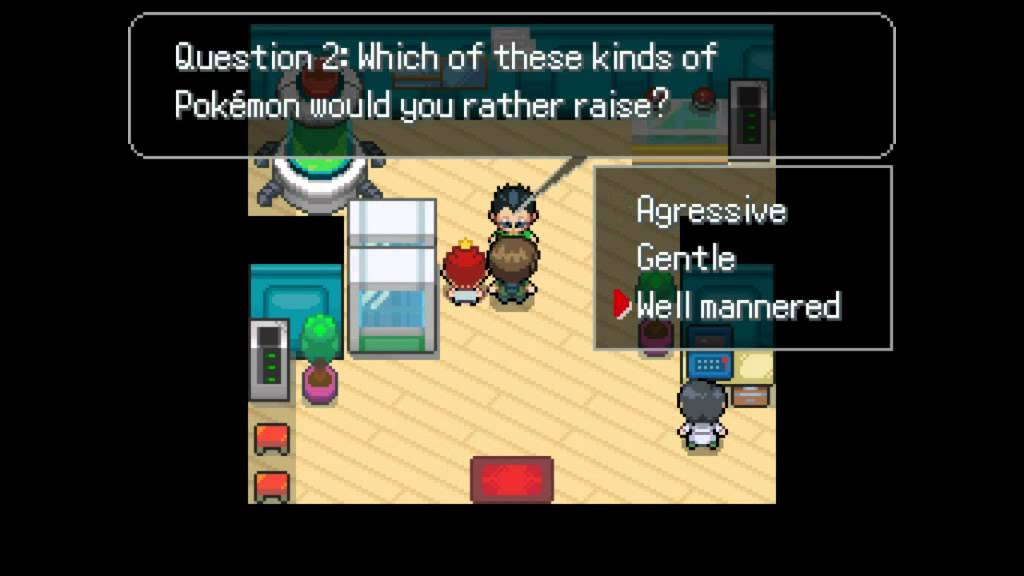
Locate an element on the screen. This screenshot has height=576, width=1024. pink pot is located at coordinates (317, 400).